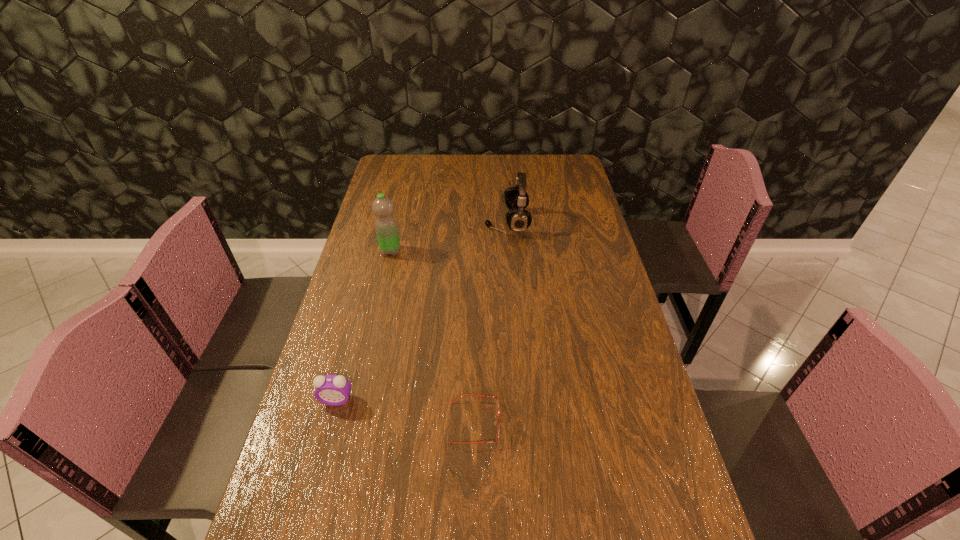
This screenshot has height=540, width=960. Find the location of `water bottle`. water bottle is located at coordinates (386, 228).

Find the location of a particular element. the farthest object is located at coordinates (518, 219).

Locate an element on the screen. This screenshot has height=540, width=960. the second shortest object is located at coordinates (334, 390).

Identify the location of the shortest object. Image resolution: width=960 pixels, height=540 pixels. (497, 402).

Where is `free region located 0.060m on the back of the third nearest object`? Image resolution: width=960 pixels, height=540 pixels. free region located 0.060m on the back of the third nearest object is located at coordinates (395, 234).

Image resolution: width=960 pixels, height=540 pixels. I want to click on free space located with the microphone on the side of the headset, so click(446, 223).

Where is `free space located with the microphone on the side of the headset`? free space located with the microphone on the side of the headset is located at coordinates (409, 223).

Locate an element on the screen. The width and height of the screenshot is (960, 540). blank space located 0.220m with the microphone on the side of the headset is located at coordinates (425, 223).

Identify the location of vacant space situated on the face of the third tallest object. (311, 496).

At what (x,y) coordinates should I click in order to perform the action: click on vacant region located on the lenses of the shortest object. Please return your answer as a coordinate pair (x, y). This screenshot has width=960, height=540. Looking at the image, I should click on (593, 422).